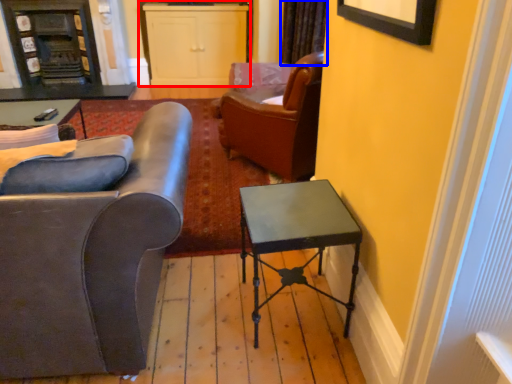
Question: Among these objects, which one is farthest to the camera, cabinetry (highlighted by a red box) or curtain (highlighted by a blue box)?

Choices:
 (A) cabinetry
 (B) curtain

Answer: (A)